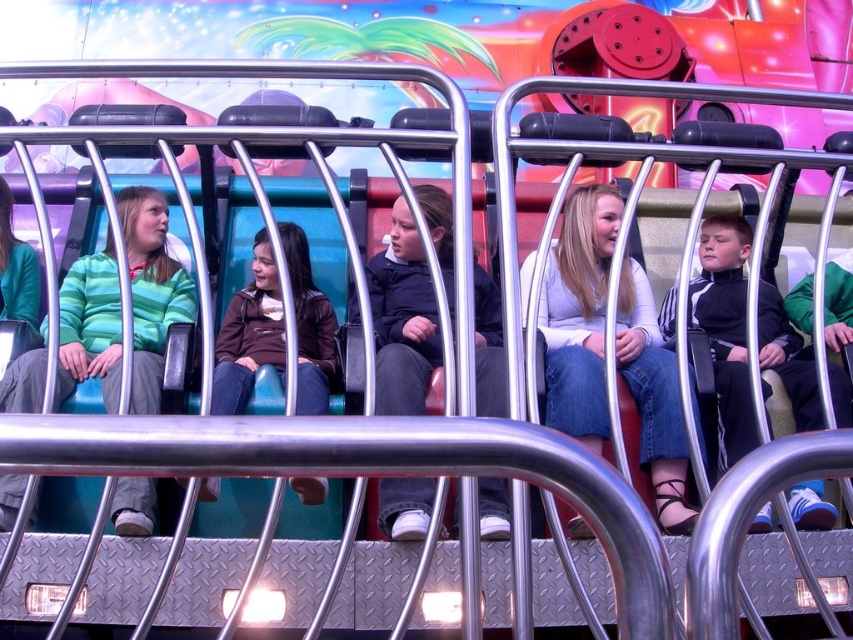
Who is more distant from viewer, (15,477) or (711,250)?

The point (711,250) is behind.

Where is `green striped sweater at left`? This screenshot has width=853, height=640. green striped sweater at left is located at coordinates (151, 291).

Where is `green striped sweater at left`? green striped sweater at left is located at coordinates (151, 291).

Is denim jeans at center smaller than brown leather jacket at center?

Correct, denim jeans at center occupies less space than brown leather jacket at center.

Measure the distance from denim jeans at center to brown leather jacket at center.

denim jeans at center and brown leather jacket at center are 7.16 meters apart.

Which is behind, point (679, 422) or point (228, 317)?

The point (228, 317) is more distant.

You are a GUI agent. You are given a task and a screenshot of the screen. Output one action in this format:
    pyautogui.click(x=<x>, y=<y>)
    Task: Click on the denim jeans at center
    The width and height of the screenshot is (853, 640).
    Given the screenshot: What is the action you would take?
    pyautogui.click(x=578, y=314)

This screenshot has width=853, height=640. Identify the location of denim jeans at center. (578, 314).

Does denim jeans at center come behind dark blue jacket at center?

Yes, it is.

Is point (595, 432) in front of point (352, 308)?

Yes, it is.

This screenshot has height=640, width=853. Identify the location of denim jeans at center. (578, 314).